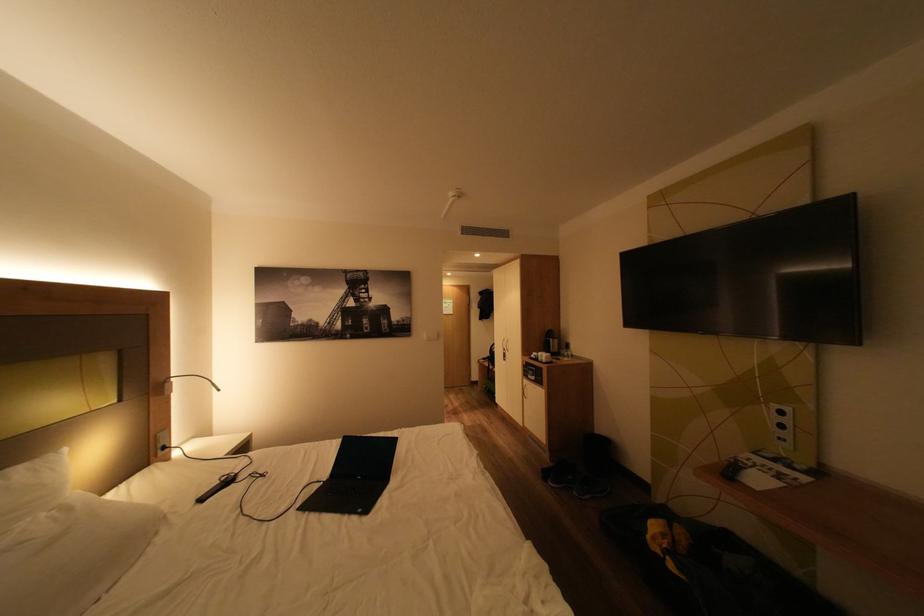
What do you see at coordinates (574, 480) in the screenshot? I see `a black shoe` at bounding box center [574, 480].